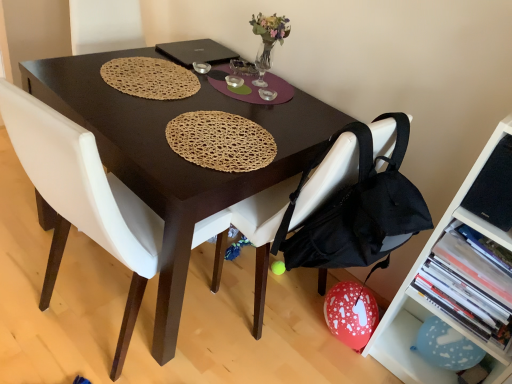
Find the location of a particular element. Image resolution: width=512 pixels, height=384 pixels. free spot below translucent glass vase at upper center (from a real-world perspective) is located at coordinates (260, 78).